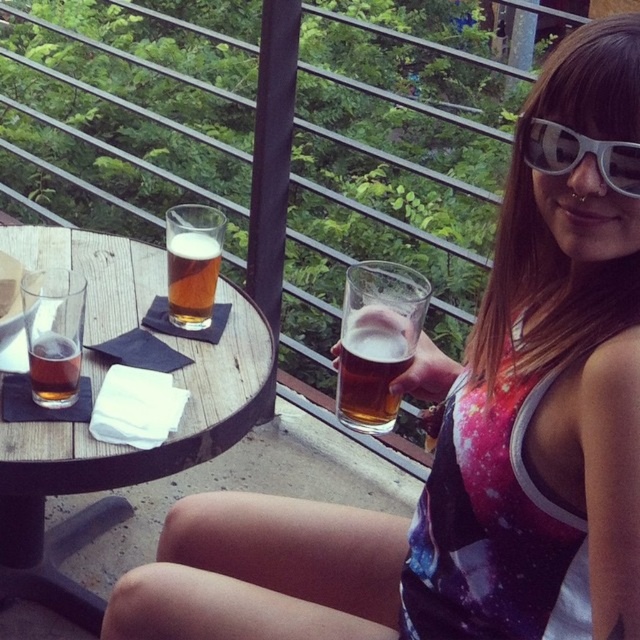
Question: Is translucent glass mug at upper center to the right of amber glass beer at center from the viewer's perspective?

Choices:
 (A) yes
 (B) no

Answer: (A)

Question: Estimate the real-world distances between objects in this image. Which object is closer to the woodenobject at left?

Choices:
 (A) amber glass beer at center
 (B) translucent glass beer at center
 (C) amber glass beer at left
 (D) white plastic sunglasses at upper right

Answer: (A)

Question: Which of the following is the closest to the observer?

Choices:
 (A) (193, 324)
 (B) (353, 336)
 (C) (570, 156)

Answer: (C)

Question: Is translucent glass mug at upper center thinner than translucent glass beer at center?

Choices:
 (A) no
 (B) yes

Answer: (A)

Question: Is white plastic sunglasses at upper right bigger than amber glass beer at center?

Choices:
 (A) yes
 (B) no

Answer: (B)

Question: Which is farther from the woodenobject at left?

Choices:
 (A) amber glass beer at center
 (B) white plastic sunglasses at upper right
 (C) translucent glass mug at upper center

Answer: (B)